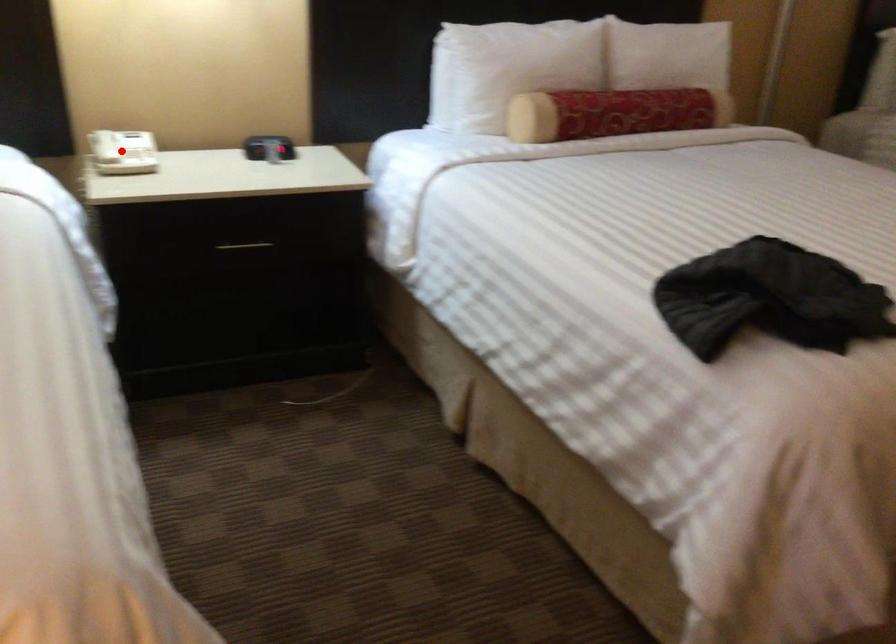
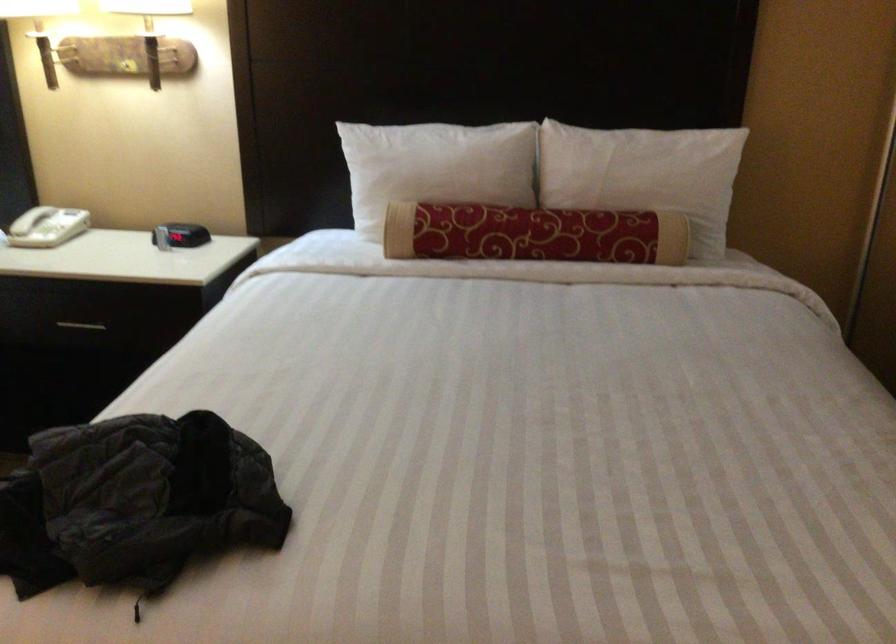
Question: I am providing you with two images of the same scene from different viewpoints. A red point is shown in image1. For the corresponding object point in image2, is it positioned nearer or farther from the camera?

Choices:
 (A) Nearer
 (B) Farther

Answer: (B)